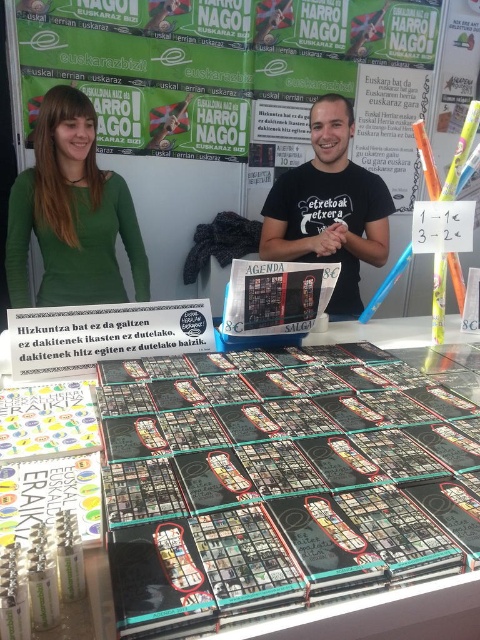
You are a customer at the book fair and want to place a small decorative item on the table. The item requires a space that is taller than the green matte shirt at upper left. Can the black glossy book at center provide enough height for this?

The black glossy book at center has a lesser height compared to green matte shirt at upper left, so it cannot provide enough height for the item that requires a space taller than the green matte shirt at upper left.

You are a customer at the book fair and want to pick up an item located at point (x=196, y=458). Can you reach it without moving your position?

The distance between you and point (x=196, y=458) is 26.09 inches. Since the average human arm length is about 25 inches, you might need to stretch slightly but can likely reach it without moving your position.

You are a customer at the book fair and want to know if the black glossy book at center will fit in the space currently occupied by the green matte shirt at upper left. Can you determine if it will fit based on their widths?

The black glossy book at center is wider than the green matte shirt at upper left, so it may not fit in the space currently occupied by the green matte shirt at upper left.